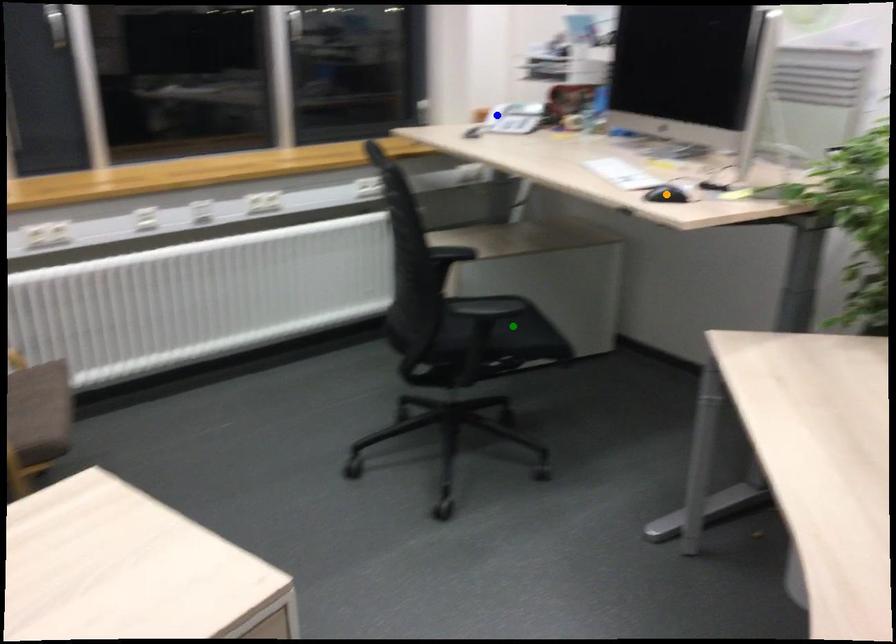
Order these from nearest to farthest:
1. orange point
2. blue point
3. green point

orange point < green point < blue point